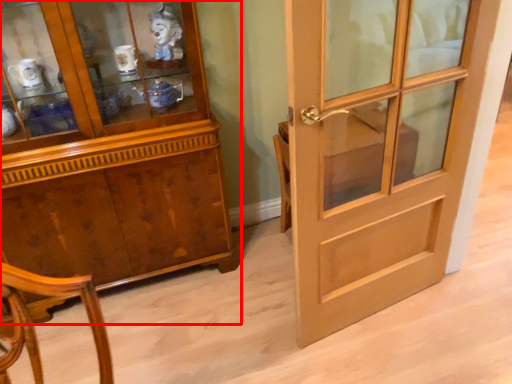
Question: Observing the image, what is the correct spatial positioning of cabinetry (annotated by the red box) in reference to door?

Choices:
 (A) right
 (B) left

Answer: (B)